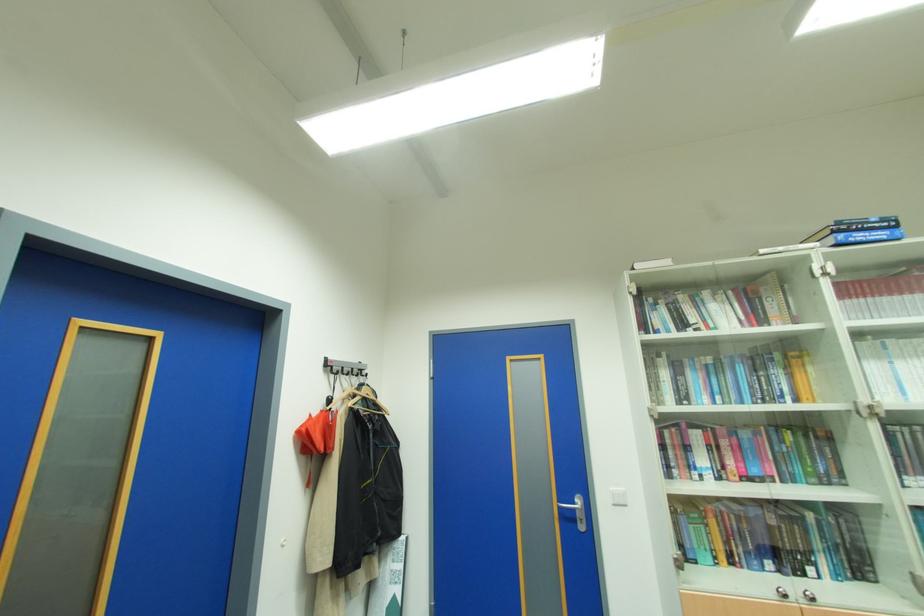
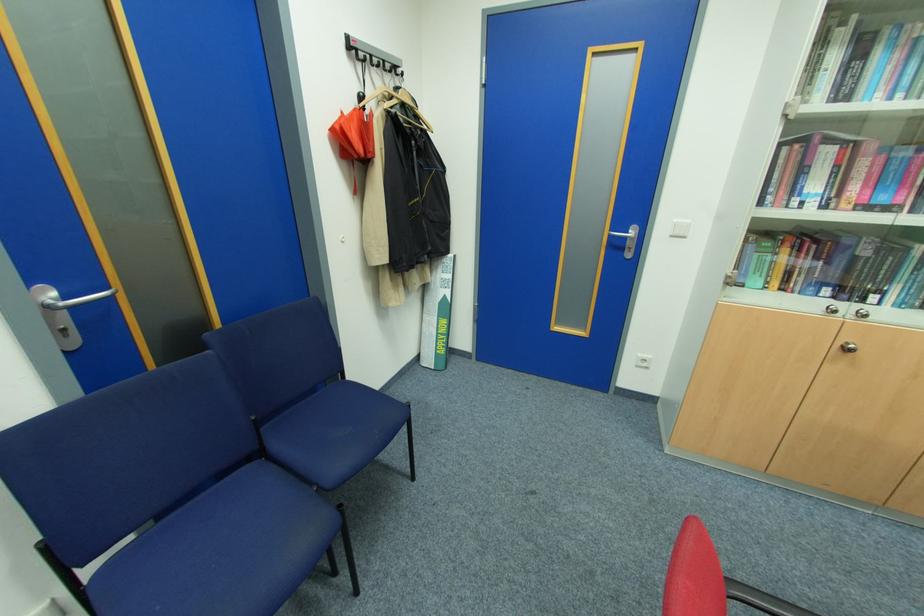
The point at (308, 430) is marked in the first image. Where is the corresponding point in the second image?

(341, 127)